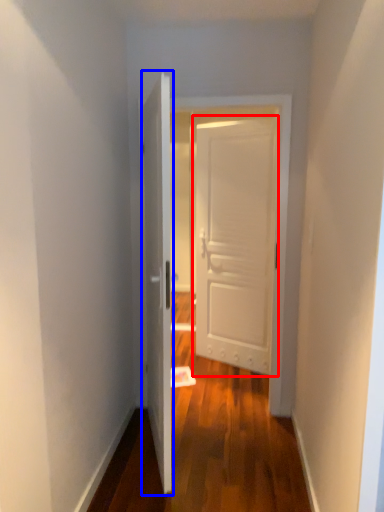
Question: Which of the following is the closest to the observer, door (highlighted by a red box) or door (highlighted by a blue box)?

Choices:
 (A) door
 (B) door

Answer: (B)